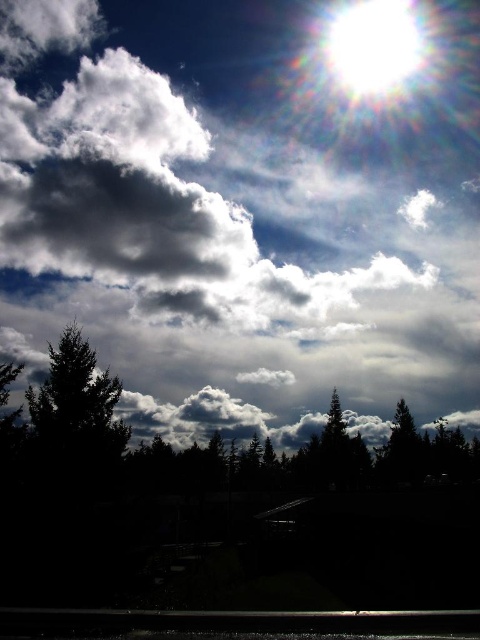
Is point (75, 474) positioned behind point (389, 17)?

No, (75, 474) is closer to viewer.

Can you confirm if dark green textured tree at left is positioned above white glossy sun at upper center?

Actually, dark green textured tree at left is below white glossy sun at upper center.

Identify the location of dark green textured tree at left. (75, 412).

Between white glossy sun at upper center and green matte tree at lower right, which one appears on the left side from the viewer's perspective?

From the viewer's perspective, green matte tree at lower right appears more on the left side.

Does white glossy sun at upper center have a lesser height compared to green matte tree at lower right?

No.

In order to click on white glossy sun at upper center in this screenshot , I will do `click(373, 48)`.

Which is below, bright white sun at upper center or white glossy sun at upper center?

bright white sun at upper center is lower down.

Who is more distant from viewer, [252,260] or [332,24]?

The point [332,24] is more distant.

Locate an element on the screen. The image size is (480, 640). bright white sun at upper center is located at coordinates (240, 214).

Locate an element on the screen. Image resolution: width=480 pixels, height=640 pixels. bright white sun at upper center is located at coordinates (240, 214).